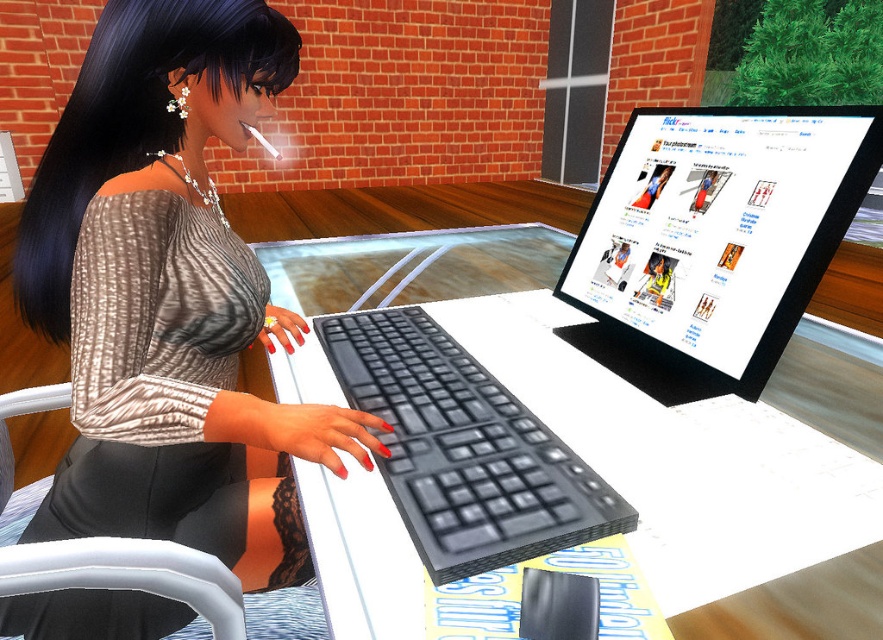
What do you see at coordinates (170, 296) in the screenshot?
I see `matte black dress at center` at bounding box center [170, 296].

Locate an element on the screen. This screenshot has width=883, height=640. matte black dress at center is located at coordinates (170, 296).

Identify the location of matte black dress at center. (170, 296).

Who is taller, black plastic keyboard at center or black matte keyboard at center?

black plastic keyboard at center

Identify the location of black plastic keyboard at center. (713, 241).

Does point (358, 320) come farther from viewer compared to point (449, 372)?

That is True.

Where is `black plastic keyboard at center`? The width and height of the screenshot is (883, 640). black plastic keyboard at center is located at coordinates (713, 241).

Does matte black monitor at upper right have a larger size compared to black matte keyboard at center?

Yes, matte black monitor at upper right is bigger than black matte keyboard at center.

Does matte black monitor at upper right have a smaller size compared to black matte keyboard at center?

Incorrect, matte black monitor at upper right is not smaller in size than black matte keyboard at center.

Identify the location of matte black monitor at upper right. (714, 241).